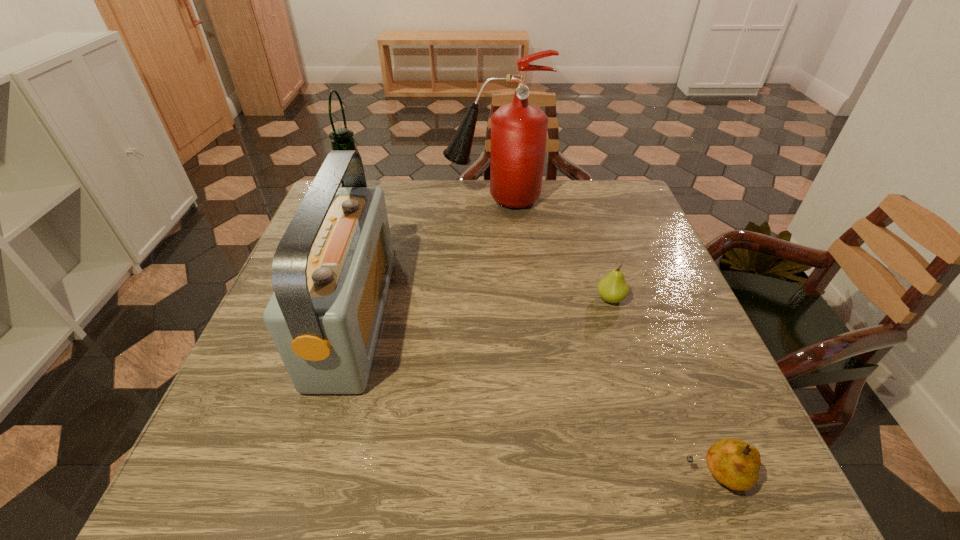
At what (x,y) coordinates should I click in order to perform the action: click on free space that satisfies the following two spatial constraints: 1. on the side where the farther pear emits light; 2. on the left side of the lantern. Please return your answer as a coordinate pair (x, y). Looking at the image, I should click on [317, 299].

Identify the location of blank area in the image that satisfies the following two spatial constraints: 1. with the nozzle aimed from the third object from right to left; 2. on the right side of the nearest object. Image resolution: width=960 pixels, height=540 pixels. (507, 475).

In order to click on vacant area that satisfies the following two spatial constraints: 1. on the front side of the farther pear; 2. on the left side of the nearer pear in this screenshot , I will do `click(665, 475)`.